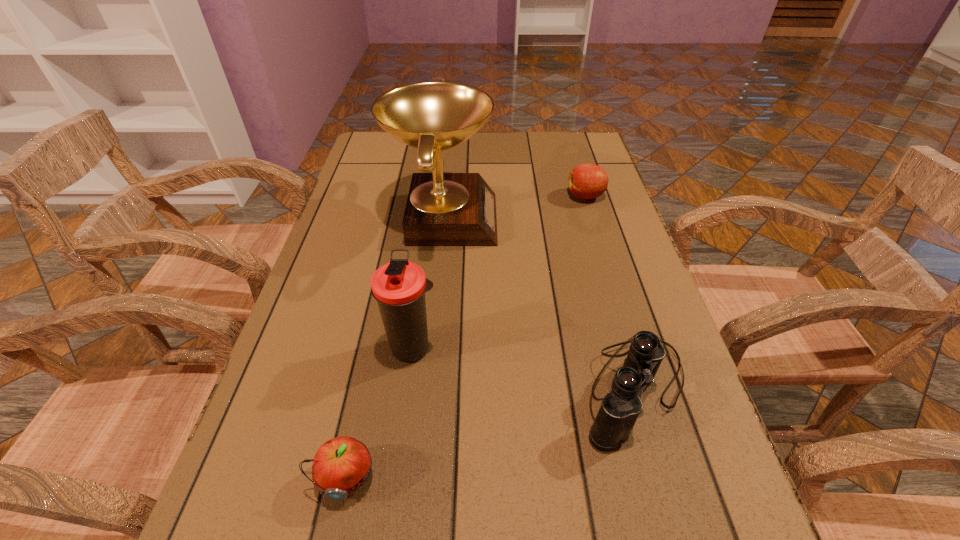
Where is `award`? This screenshot has width=960, height=540. award is located at coordinates (443, 209).

Where is `thermos bottle`? This screenshot has width=960, height=540. thermos bottle is located at coordinates (399, 286).

Identify the location of binoculars. (620, 408).

The width and height of the screenshot is (960, 540). Find the location of `the farther apple`. the farther apple is located at coordinates (586, 181).

Where is `the left apple`? This screenshot has width=960, height=540. the left apple is located at coordinates (341, 466).

Identify the location of vacant space located 0.050m on the front-facing side of the award. The width and height of the screenshot is (960, 540). (516, 217).

You are a GUI agent. You are given a task and a screenshot of the screen. Output one action in this format:
    pyautogui.click(x=<x>, y=<y>)
    Task: Click on the vacant space positioned 0.240m on the back of the second tallest object
    
    Given the screenshot: What is the action you would take?
    pyautogui.click(x=426, y=249)

The height and width of the screenshot is (540, 960). I want to click on vacant space located on the back of the binoculars, so click(x=599, y=268).

Find the location of `vacant space located on the front of the right apple`. vacant space located on the front of the right apple is located at coordinates (600, 245).

This screenshot has width=960, height=540. I want to click on vacant area located 0.360m on the right of the left apple, so click(613, 478).